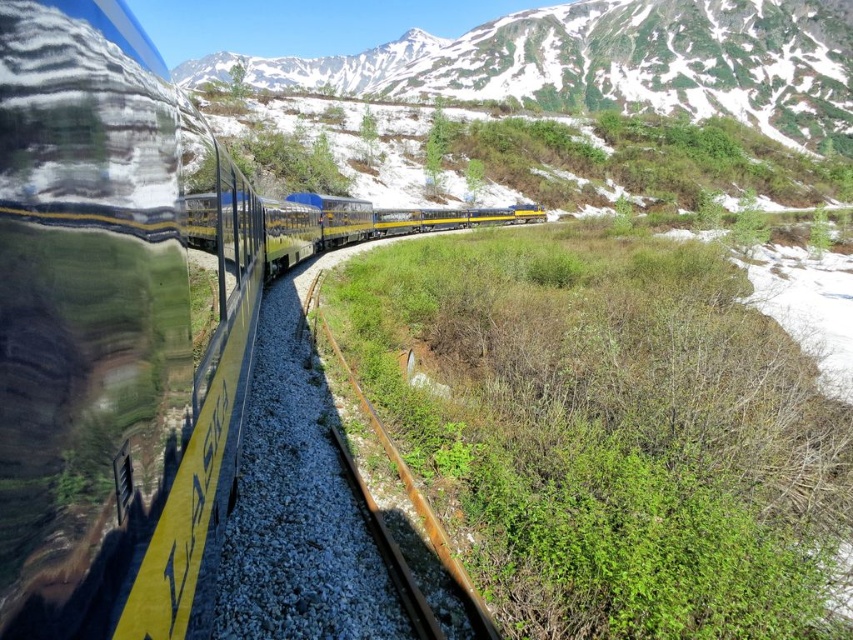
You are an engineer trying to determine the position of the yellow polished metal train at left on a coordinate system where the bottom left corner is the origin. What are its coordinates?

The yellow polished metal train at left is located at coordinates approximately 0.508 on the x axis and 0.135 on the y axis.

You are standing at the edge of the railway track looking towards the train. There are two points marked on the track ahead of you. Which point, point [48,195] or point [358,401], is closer to your current position?

Point [48,195] is closer to the viewer than point [358,401].